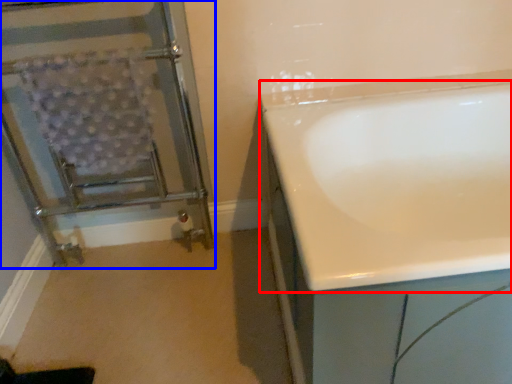
Question: Which object appears farthest to the camera in this image, bathtub (highlighted by a red box) or screen door (highlighted by a blue box)?

Choices:
 (A) bathtub
 (B) screen door

Answer: (B)